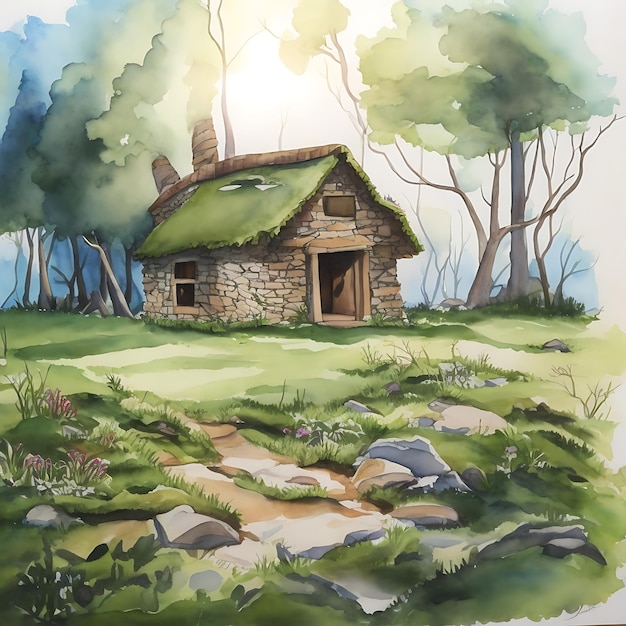
Locate an element on the screen. The height and width of the screenshot is (626, 626). painting is located at coordinates (298, 347).